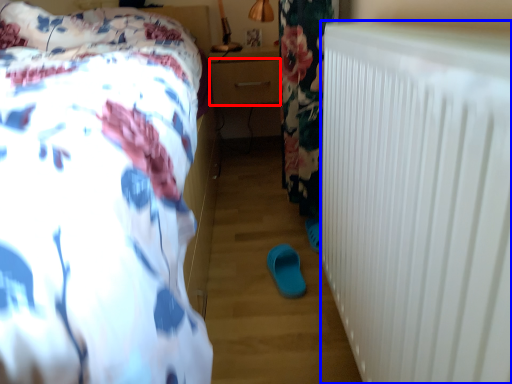
Question: Which object is further to the camera taking this photo, drawer (highlighted by a red box) or radiator (highlighted by a blue box)?

Choices:
 (A) drawer
 (B) radiator

Answer: (A)